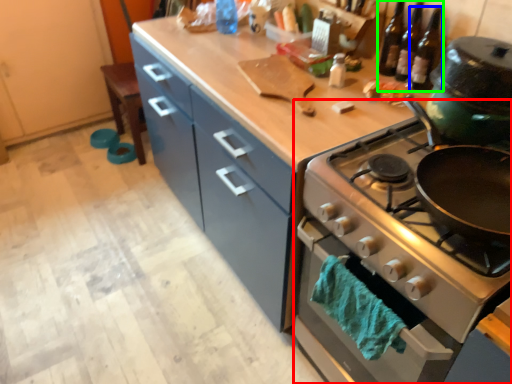
Question: Which object is positioned farthest from oven (highlighted by a red box)? Select from beer bottle (highlighted by a blue box) and wine bottle (highlighted by a green box).

Choices:
 (A) beer bottle
 (B) wine bottle

Answer: (A)